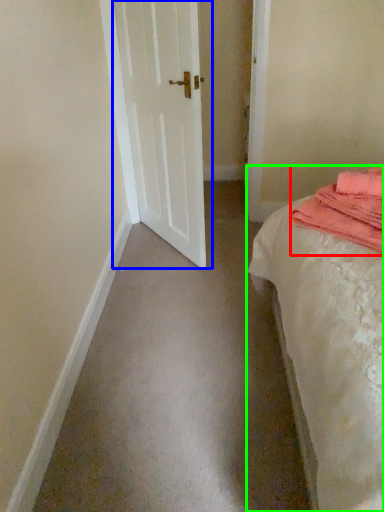
Question: Which object is positioned farthest from material (highlighted by a red box)? Select from door (highlighted by a blue box) and bed (highlighted by a green box).

Choices:
 (A) door
 (B) bed

Answer: (A)